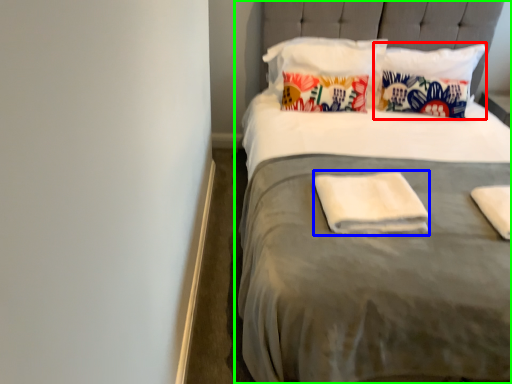
Question: Based on their relative distances, which object is nearer to pillow (highlighted by a red box)? Choose from material (highlighted by a blue box) and bed (highlighted by a green box).

Choices:
 (A) material
 (B) bed

Answer: (B)